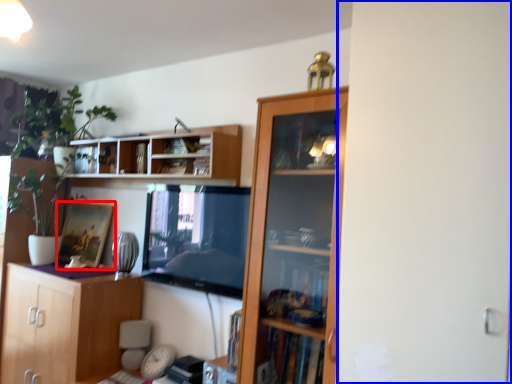
Question: Which object is closer to the camera taking this photo, picture frame (highlighted by a red box) or screen door (highlighted by a blue box)?

Choices:
 (A) picture frame
 (B) screen door

Answer: (B)